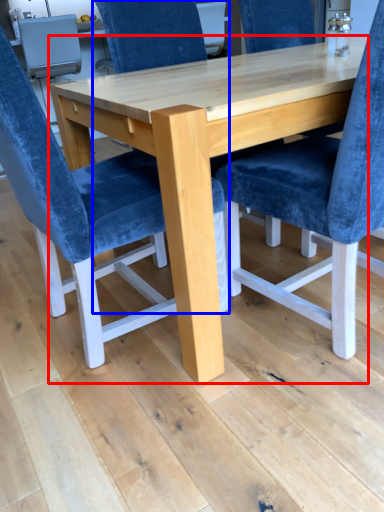
Question: Which object is closer to the camera taking this photo, table (highlighted by a red box) or chair (highlighted by a blue box)?

Choices:
 (A) table
 (B) chair

Answer: (A)